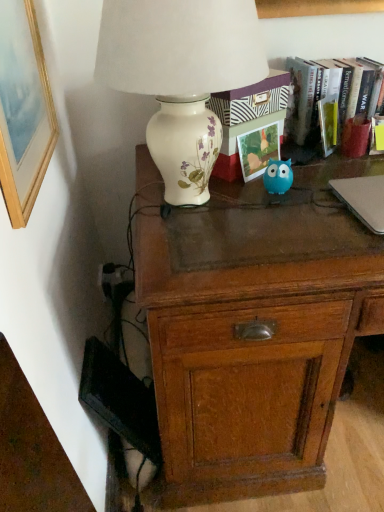
Measure the distance between blue rubber toy at center and camera.

A distance of 3.72 feet exists between blue rubber toy at center and camera.

Measure the distance between matte paper photo frame at center and camera.

They are 3.85 feet apart.

Where is `matte paper photo frame at center`? matte paper photo frame at center is located at coordinates (258, 150).

Describe the element at coordinates (23, 110) in the screenshot. I see `wooden picture frame at upper left` at that location.

At what (x,y) coordinates should I click in order to perform the action: click on blue rubber toy at center. Please return your answer as a coordinate pair (x, y). Looking at the image, I should click on (278, 176).

What's the angular difference between hardcover book at upper right and silver metallic laptop at right's facing directions?

hardcover book at upper right and silver metallic laptop at right are facing 2.06 degrees away from each other.

From the image's perspective, relative to silver metallic laptop at right, is hardcover book at upper right above or below?

Clearly, from the image's perspective, hardcover book at upper right is above silver metallic laptop at right.

Is silver metallic laptop at right surrounded by hardcover book at upper right?

No, silver metallic laptop at right is not inside hardcover book at upper right.

Identify the location of book located behind the silver metallic laptop at right. (317, 101).

From the image's perspective, is blue rubber toy at center positioned above or below wooden desk at center?

From the image's perspective, blue rubber toy at center appears above wooden desk at center.

Which is in front, point (265, 180) or point (220, 467)?

The point (220, 467) is closer to the camera.

Would you say blue rubber toy at center is outside wooden desk at center?

Absolutely, blue rubber toy at center is external to wooden desk at center.

Measure the distance between matte paper photo frame at center and porcelain floral lamp at upper left.

matte paper photo frame at center is 31.24 centimeters from porcelain floral lamp at upper left.

Identify the location of lamp in front of the matte paper photo frame at center. Image resolution: width=384 pixels, height=512 pixels. (181, 76).

Which of these two, matte paper photo frame at center or porcelain floral lamp at upper left, stands shorter?

Standing shorter between the two is matte paper photo frame at center.

Who is smaller, matte paper photo frame at center or porcelain floral lamp at upper left?

With smaller size is matte paper photo frame at center.

From the image's perspective, which one is positioned higher, matte paper photo frame at center or wooden desk at center?

matte paper photo frame at center is shown above in the image.

Considering the sizes of matte paper photo frame at center and wooden desk at center in the image, is matte paper photo frame at center wider or thinner than wooden desk at center?

matte paper photo frame at center is thinner than wooden desk at center.

Looking at this image, which object is positioned more to the left, matte paper photo frame at center or wooden desk at center?

Positioned to the left is matte paper photo frame at center.

Is matte paper photo frame at center shorter than wooden desk at center?

Indeed, matte paper photo frame at center has a lesser height compared to wooden desk at center.

Is wooden desk at center facing away from porcelain floral lamp at upper left?

No, wooden desk at center is not facing the opposite direction of porcelain floral lamp at upper left.

Where is `lamp located on the left of wooden desk at center`? The height and width of the screenshot is (512, 384). lamp located on the left of wooden desk at center is located at coordinates (181, 76).

Considering the points (371, 271) and (127, 25), which point is in front, point (371, 271) or point (127, 25)?

The point (127, 25) is in front.

Is point (218, 48) more distant than point (367, 234)?

That is False.

Is porcelain floral lamp at upper left placed right next to wooden desk at center?

No.

Considering the relative sizes of porcelain floral lamp at upper left and wooden desk at center in the image provided, is porcelain floral lamp at upper left shorter than wooden desk at center?

Yes, porcelain floral lamp at upper left is shorter than wooden desk at center.

Who is bigger, porcelain floral lamp at upper left or wooden desk at center?

wooden desk at center.

In the scene shown: Is blue rubber toy at center bigger than silver metallic laptop at right?

No.

From the image's perspective, between blue rubber toy at center and silver metallic laptop at right, who is located below?

silver metallic laptop at right.

Considering the relative positions of blue rubber toy at center and silver metallic laptop at right in the image provided, is blue rubber toy at center behind silver metallic laptop at right?

Yes.

Does blue rubber toy at center turn towards silver metallic laptop at right?

No, blue rubber toy at center is not turned towards silver metallic laptop at right.

I want to click on book behind the silver metallic laptop at right, so click(x=317, y=101).

In order to click on desk that is in front of the blue rubber toy at center in this screenshot , I will do `click(255, 330)`.

Looking at the image, which one is located further to wooden picture frame at upper left, blue rubber toy at center or wooden desk at center?

Based on the image, blue rubber toy at center appears to be further to wooden picture frame at upper left.

Estimate the real-world distances between objects in this image. Which object is closer to hardcover book at upper right, blue rubber toy at center or silver metallic laptop at right?

Based on the image, blue rubber toy at center appears to be nearer to hardcover book at upper right.

Considering their positions, is blue rubber toy at center positioned closer to wooden picture frame at upper left than silver metallic laptop at right?

blue rubber toy at center is closer to wooden picture frame at upper left.

Estimate the real-world distances between objects in this image. Which object is further from hardcover book at upper right, wooden desk at center or blue rubber toy at center?

The object further to hardcover book at upper right is wooden desk at center.

Considering their positions, is blue rubber toy at center positioned closer to hardcover book at upper right than wooden desk at center?

Based on the image, blue rubber toy at center appears to be nearer to hardcover book at upper right.

Estimate the real-world distances between objects in this image. Which object is further from matte paper photo frame at center, wooden desk at center or hardcover book at upper right?

Based on the image, wooden desk at center appears to be further to matte paper photo frame at center.

From the image, which object appears to be farther from matte paper photo frame at center, porcelain floral lamp at upper left or wooden desk at center?

Based on the image, wooden desk at center appears to be further to matte paper photo frame at center.

Looking at the image, which one is located further to matte paper photo frame at center, blue rubber toy at center or silver metallic laptop at right?

Among the two, silver metallic laptop at right is located further to matte paper photo frame at center.

The height and width of the screenshot is (512, 384). What are the coordinates of `lamp located between wooden picture frame at upper left and hardcover book at upper right in the left-right direction` in the screenshot? It's located at (181, 76).

The height and width of the screenshot is (512, 384). I want to click on desk situated between wooden picture frame at upper left and hardcover book at upper right from left to right, so click(255, 330).

The image size is (384, 512). I want to click on paperback book between wooden picture frame at upper left and wooden desk at center, so click(258, 150).

The width and height of the screenshot is (384, 512). I want to click on animal between matte paper photo frame at center and silver metallic laptop at right in the horizontal direction, so click(278, 176).